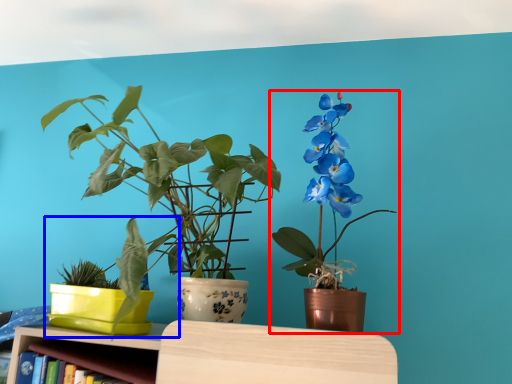
Question: Which point is further to the camera, houseplant (highlighted by a red box) or houseplant (highlighted by a blue box)?

Choices:
 (A) houseplant
 (B) houseplant

Answer: (B)